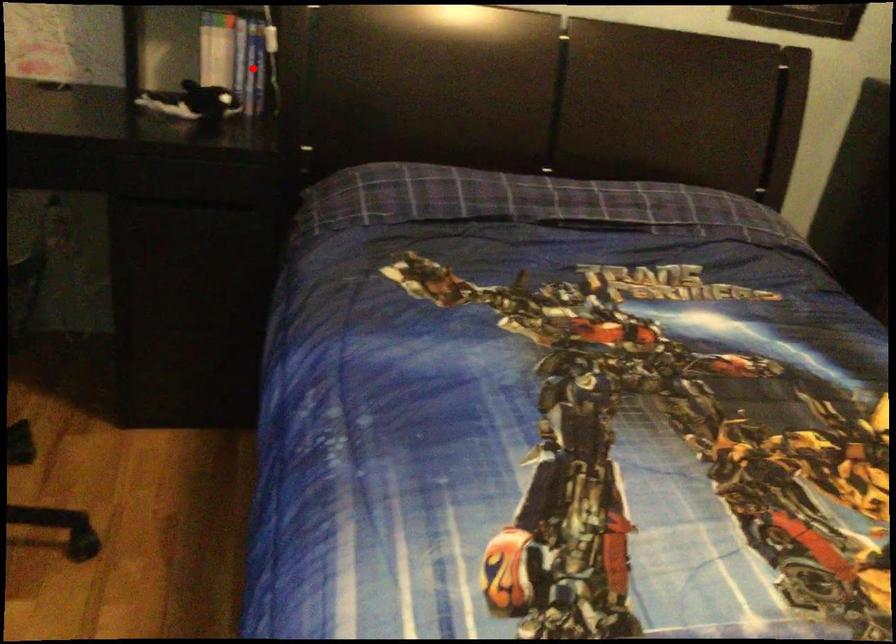
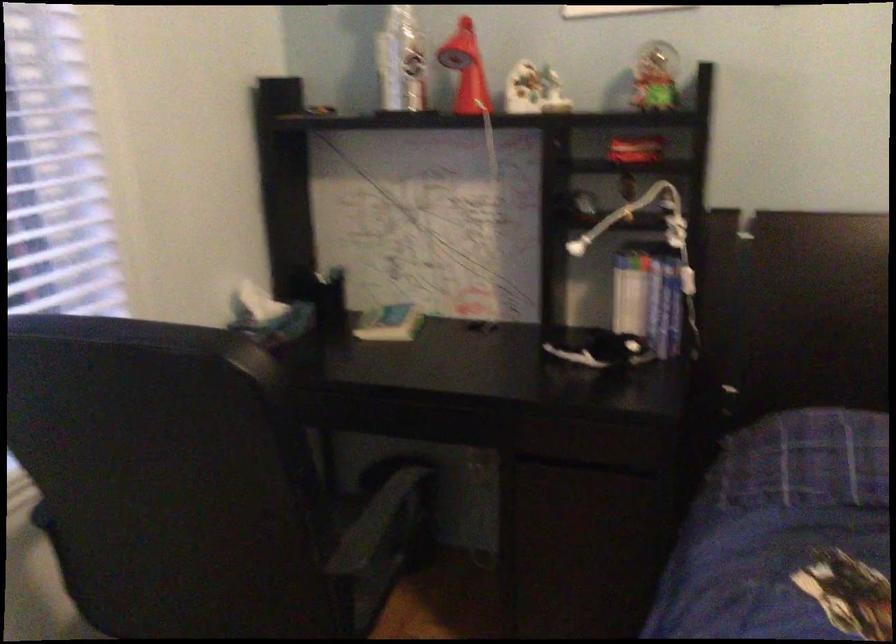
Locate, in the second image, the point that corresponds to the highlighted location in the first image.

(664, 307)